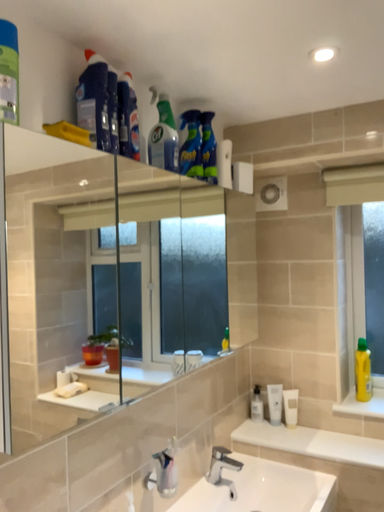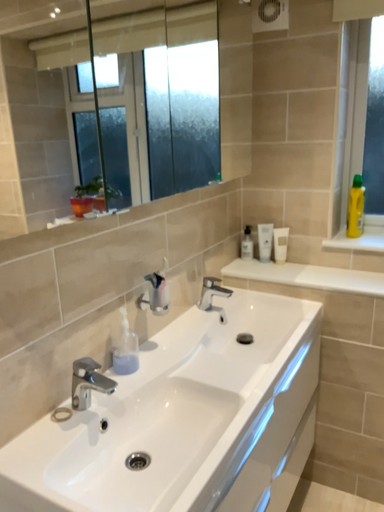
Question: Which way did the camera rotate in the video?

Choices:
 (A) rotated upward
 (B) rotated downward

Answer: (B)